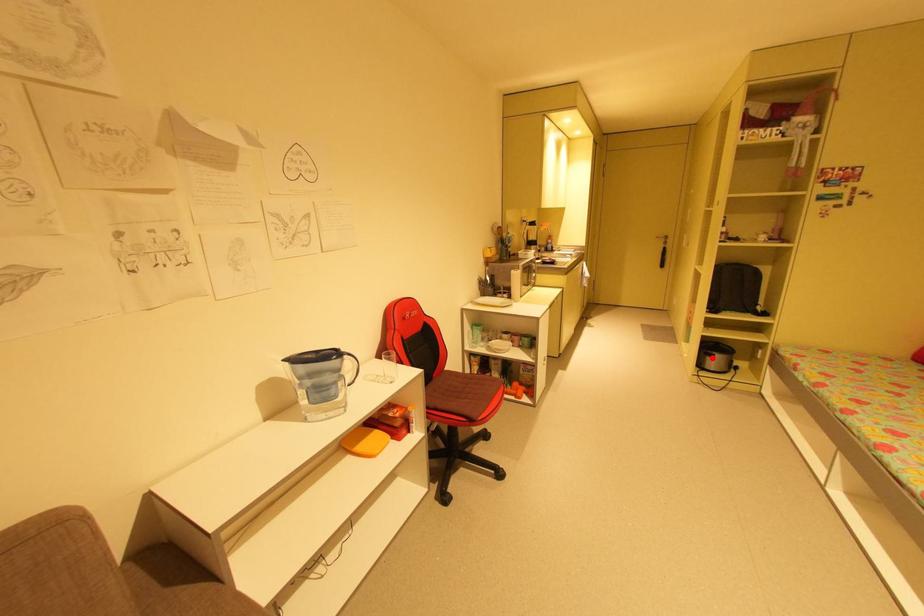
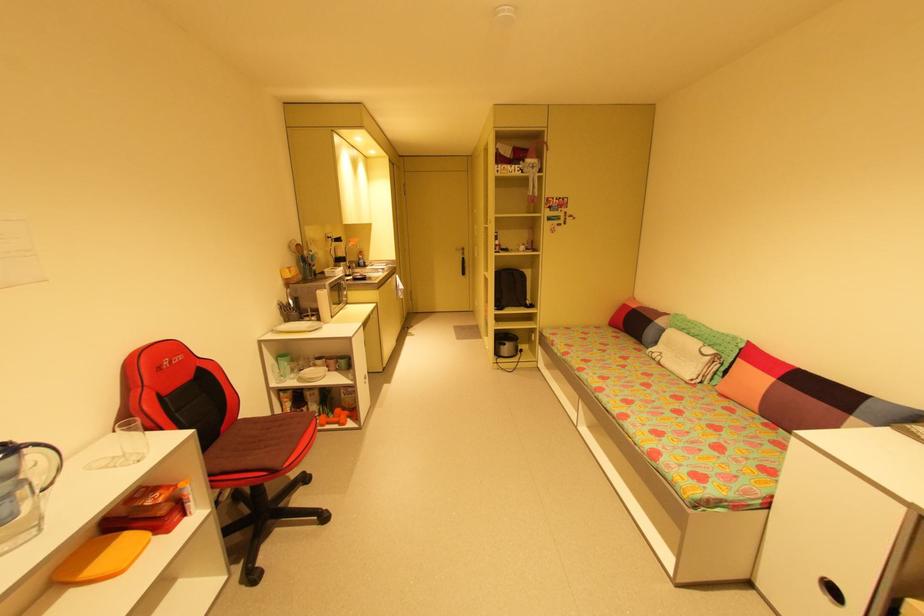
Question: I am providing you with two images of the same scene from different viewpoints. Given a red point in image1, look at the same physical point in image2. Is it:

Choices:
 (A) Closer to the viewpoint
 (B) Farther from the viewpoint

Answer: (B)